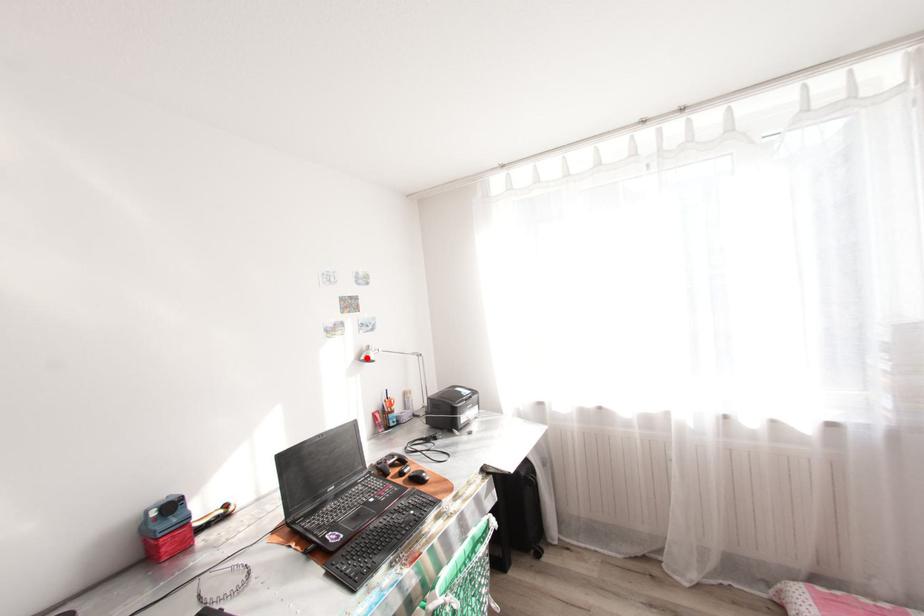
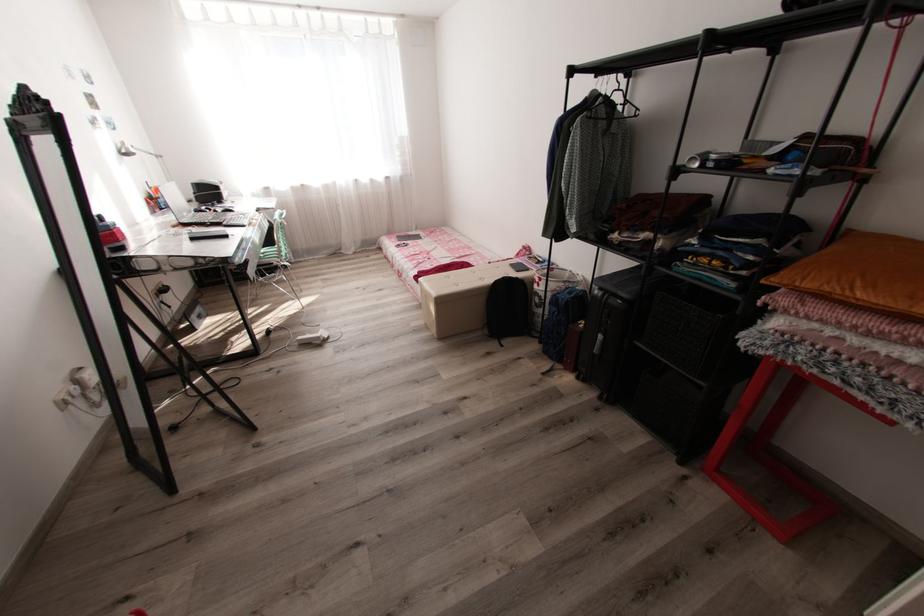
In the second image, find the point that corresponds to the highlighted location in the first image.

(129, 151)